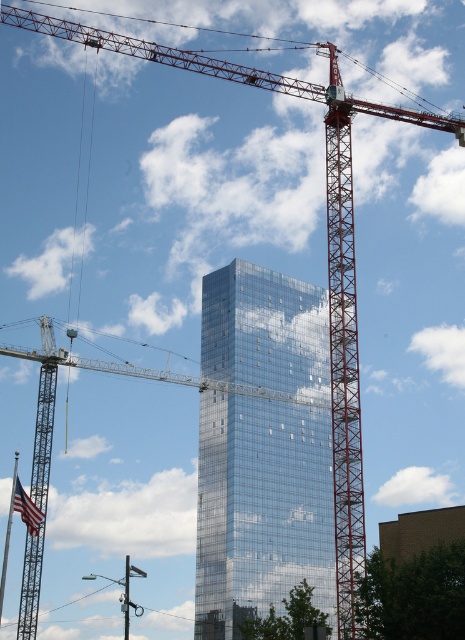
You are an architect reviewing a blueprint of the construction site. You notice two points marked on the blueprint at coordinates point (327,465) and point (46,456). According to the blueprint, which point is closer to the viewer?

Point (46,456) is closer to the viewer because point (327,465) is behind it.

You are standing at the base of the glassy reflective skyscraper at center. You want to walk to the construction crane located to the left of the skyscraper. How far will you have to walk?

The glassy reflective skyscraper at center and viewer are 497.99 feet apart from each other. Since the construction crane is to the left of the skyscraper, you would need to walk around the building or along the perimeter to reach it, but the exact distance cannot be determined from the given information.

You are a city planner reviewing this construction site. You need to determine if the glassy reflective skyscraper at center will block the view of the metallic gray crane at center from the adjacent park. Based on their positions, can you see the crane from the park?

The glassy reflective skyscraper at center is below the metallic gray crane at center, so the crane would be visible above the building from the park.